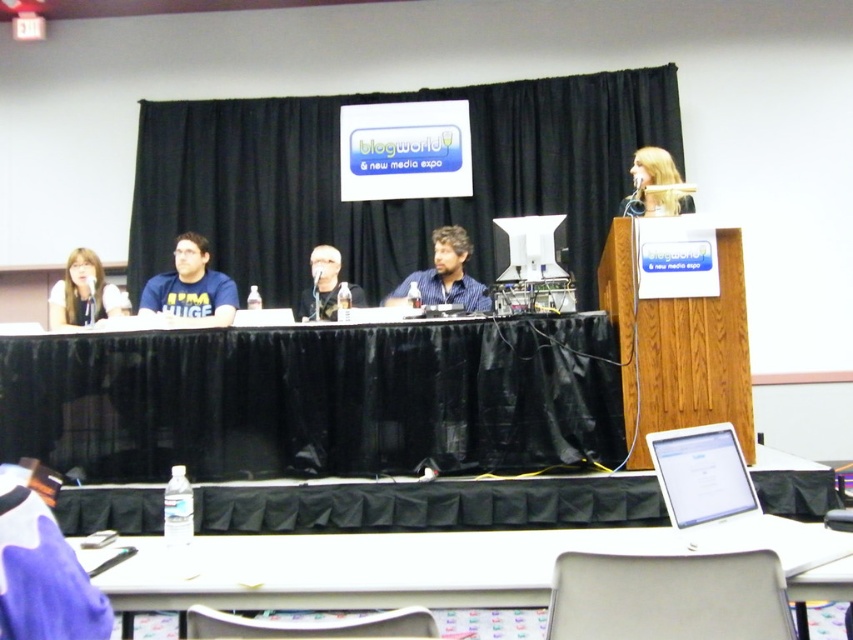
Question: Considering the real-world distances, which object is closest to the matte black microphone at center?

Choices:
 (A) white plastic table at lower center
 (B) blue striped shirt at center
 (C) blue t-shirt at left

Answer: (B)

Question: Which object is closer to the camera taking this photo?

Choices:
 (A) blue t-shirt at left
 (B) black fabric table at center
 (C) silver metallic laptop at lower right
 (D) blonde hair at upper right

Answer: (C)

Question: Based on their relative distances, which object is nearer to the blue striped shirt at center?

Choices:
 (A) silver metallic laptop at lower right
 (B) blonde hair at upper right

Answer: (B)

Question: Does white plastic table at lower center have a larger size compared to matte black microphone at center?

Choices:
 (A) no
 (B) yes

Answer: (B)

Question: Does black fabric table at center have a greater width compared to white plastic table at lower center?

Choices:
 (A) yes
 (B) no

Answer: (A)

Question: Can you confirm if black fabric table at center is bigger than matte black microphone at center?

Choices:
 (A) no
 (B) yes

Answer: (B)